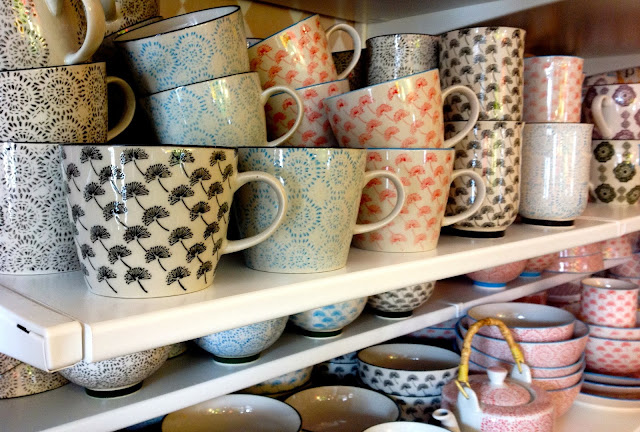
You are a GUI agent. You are given a task and a screenshot of the screen. Output one action in this format:
    pyautogui.click(x=<x>, y=<y>)
    Task: Click on the handles
    
    Given the screenshot: What is the action you would take?
    pyautogui.click(x=93, y=32), pyautogui.click(x=124, y=86), pyautogui.click(x=296, y=115), pyautogui.click(x=354, y=47), pyautogui.click(x=467, y=92), pyautogui.click(x=477, y=179), pyautogui.click(x=397, y=188), pyautogui.click(x=603, y=104), pyautogui.click(x=589, y=188), pyautogui.click(x=465, y=344)